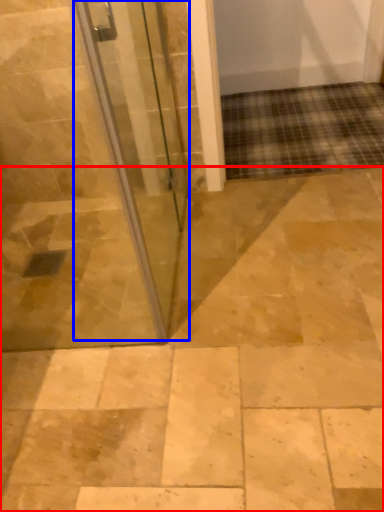
Question: Which object is further to the camera taking this photo, path (highlighted by a red box) or door (highlighted by a blue box)?

Choices:
 (A) path
 (B) door

Answer: (A)